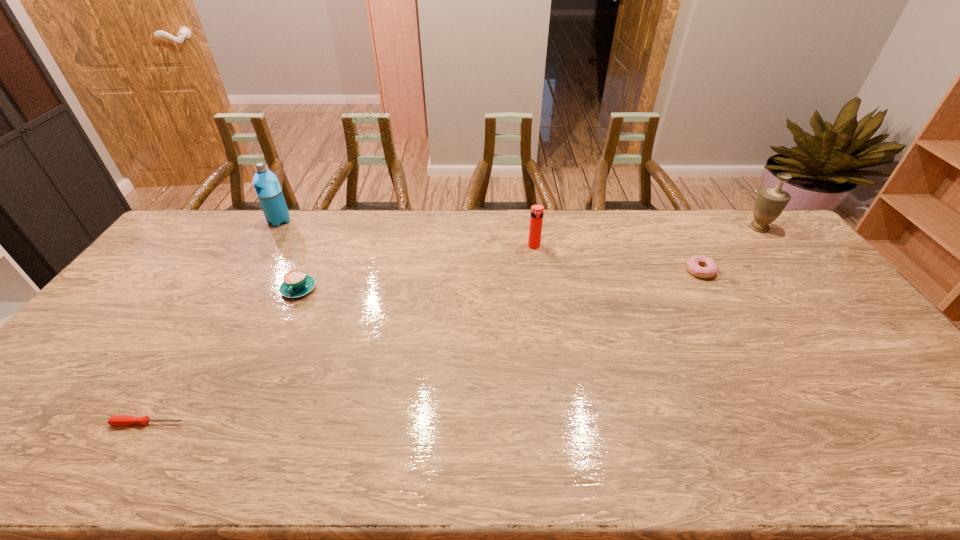
This screenshot has width=960, height=540. In the image, there is a desktop. Identify the location of vacant space at the far edge. (308, 233).

The width and height of the screenshot is (960, 540). In the image, there is a desktop. Identify the location of vacant region at the near edge. (330, 438).

Identify the location of vacant space at the left edge of the desktop. The width and height of the screenshot is (960, 540). (60, 396).

This screenshot has height=540, width=960. I want to click on vacant area at the right edge of the desktop, so click(x=855, y=323).

Where is `vacant point located between the nearer thermos bottle and the farther thermos bottle`? The height and width of the screenshot is (540, 960). vacant point located between the nearer thermos bottle and the farther thermos bottle is located at coordinates (407, 233).

Image resolution: width=960 pixels, height=540 pixels. Identify the location of free space between the shortest object and the fifth tallest object. (424, 347).

Locate an element on the screen. This screenshot has width=960, height=540. vacant space in between the shortest object and the right thermos bottle is located at coordinates (341, 334).

This screenshot has width=960, height=540. Identify the location of free space between the third object from left to right and the nearest object. (224, 356).

I want to click on free point between the doughnut and the nearest object, so click(424, 347).

The height and width of the screenshot is (540, 960). What are the coordinates of `free area in between the farther thermos bottle and the third object from left to right` in the screenshot? It's located at (289, 255).